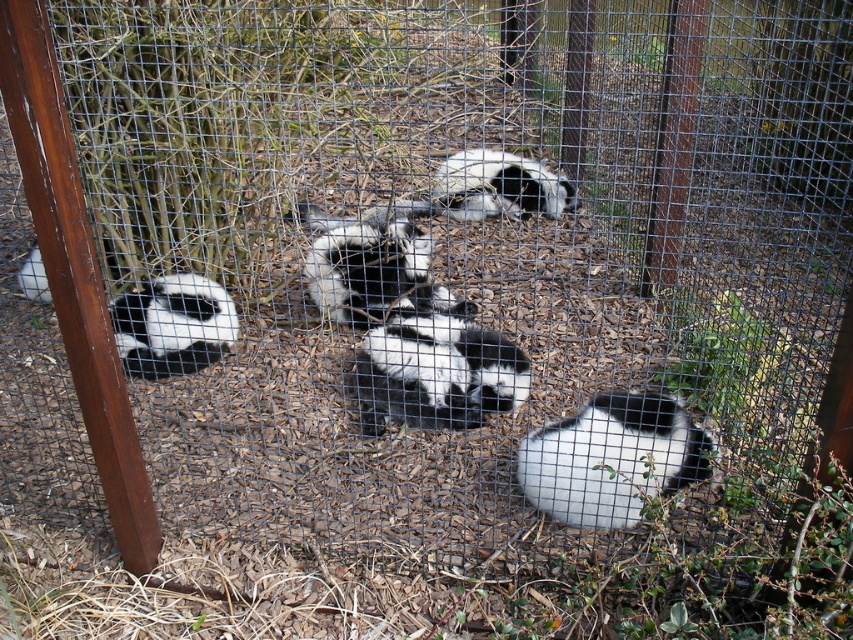
Is point (407, 372) in front of point (459, 214)?

That is True.

Consider the image. Does black glossy panda at center appear on the left side of black and white fur at center?

Indeed, black glossy panda at center is positioned on the left side of black and white fur at center.

Locate an element on the screen. black glossy panda at center is located at coordinates (436, 372).

At what (x,y) coordinates should I click in order to perform the action: click on black glossy panda at center. Please return your answer as a coordinate pair (x, y). Looking at the image, I should click on (436, 372).

Consider the image. Between soft fur panda at lower right and black and white fur at center, which one is positioned lower?

soft fur panda at lower right is lower down.

Can you confirm if soft fur panda at lower right is smaller than black and white fur at center?

Yes.

Identify the location of soft fur panda at lower right. This screenshot has width=853, height=640. (612, 458).

Between soft fur panda at lower right and black and white fur panda at left, which one is positioned lower?

Positioned lower is soft fur panda at lower right.

Where is `soft fur panda at lower right`? Image resolution: width=853 pixels, height=640 pixels. soft fur panda at lower right is located at coordinates (612, 458).

Identify the location of soft fur panda at lower right. (612, 458).